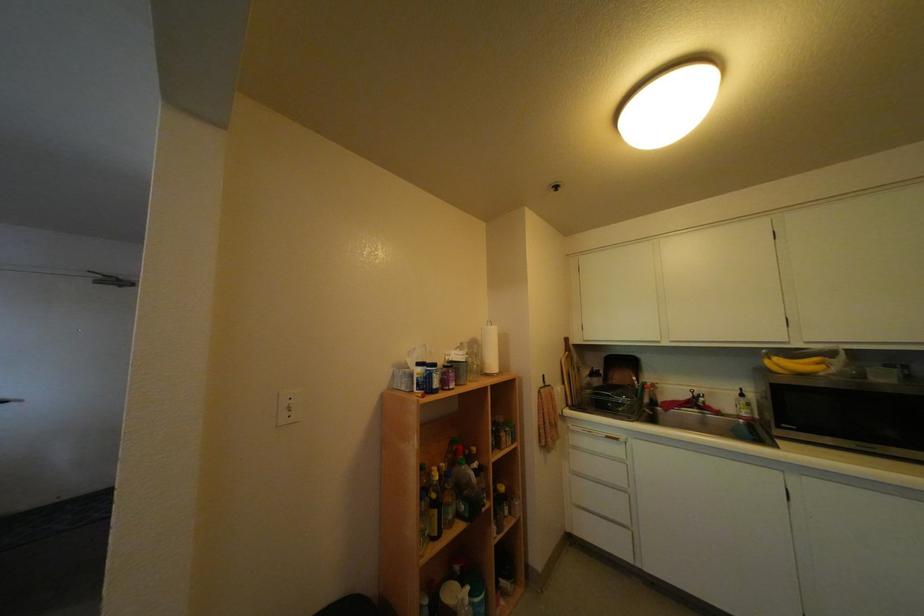
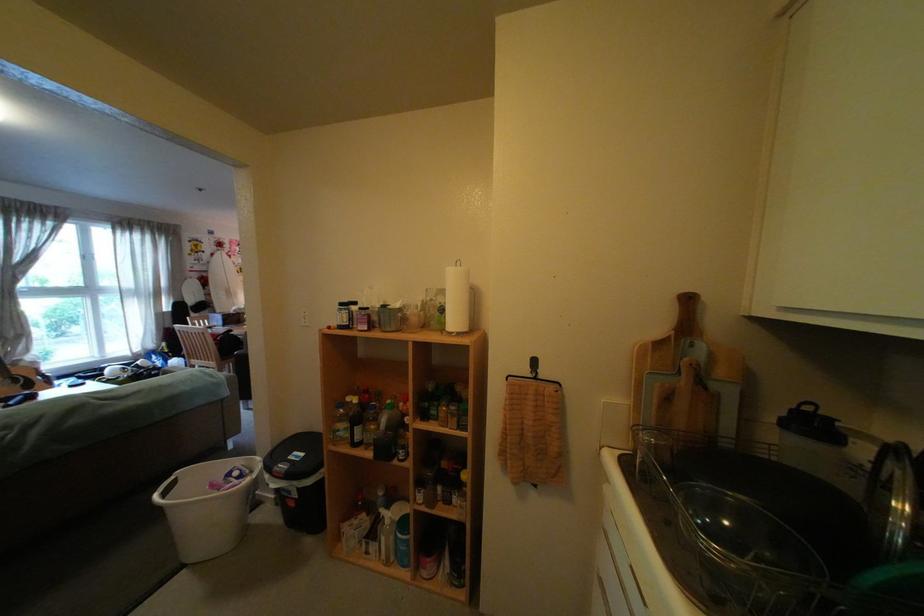
In the second image, find the point that corresponds to (x=565, y=395) in the first image.

(558, 398)